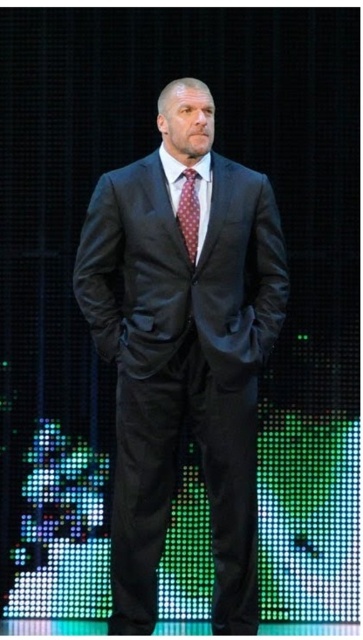
Is matte black suit at center positioned at the back of polka dot silk tie at center?

No, matte black suit at center is in front of polka dot silk tie at center.

Find the location of a particular element. matte black suit at center is located at coordinates (184, 349).